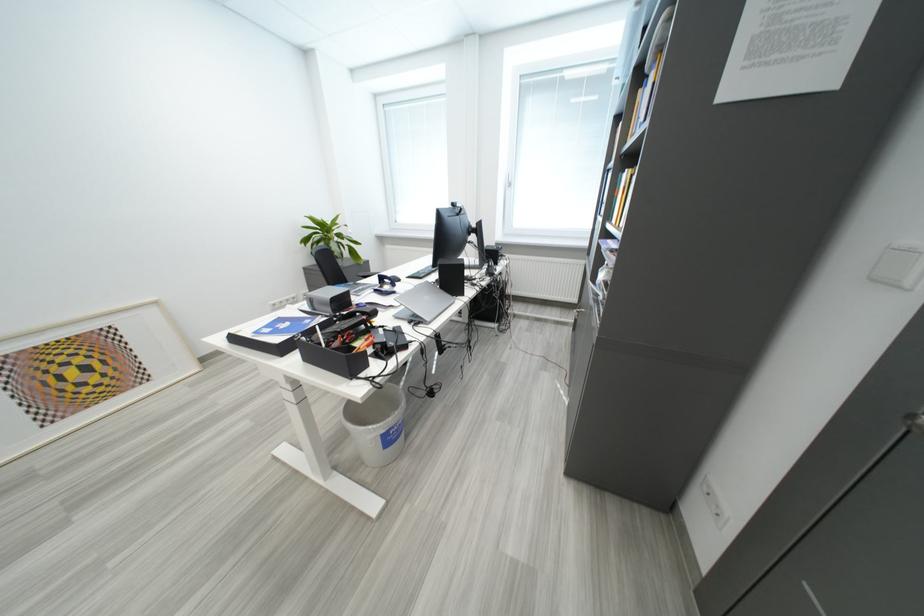
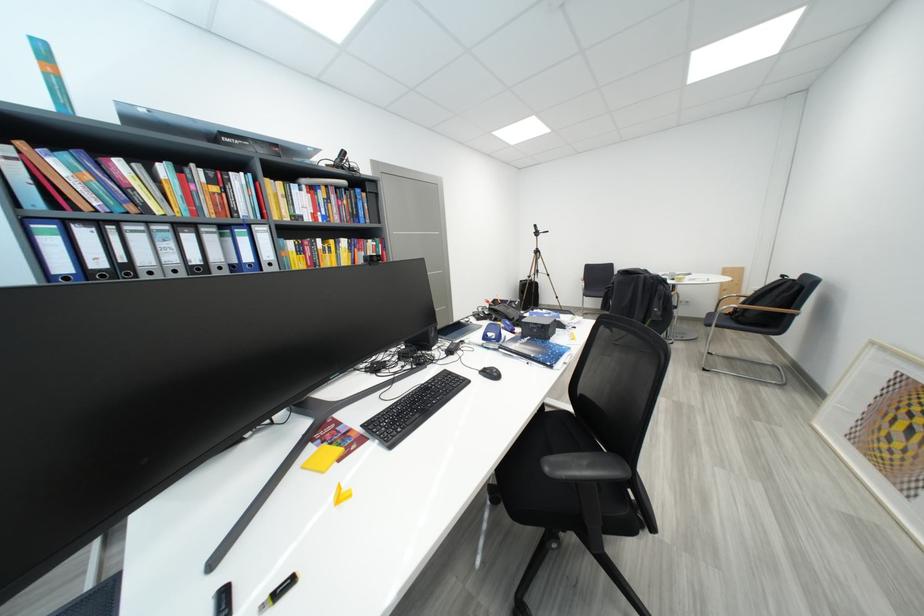
Question: I am providing you with two images of the same scene from different viewpoints. Please identify which objects are invisible in image2.

Choices:
 (A) backpack top handle
 (B) yellow book
 (C) white picture frame
 (D) red suitcase

Answer: (B)